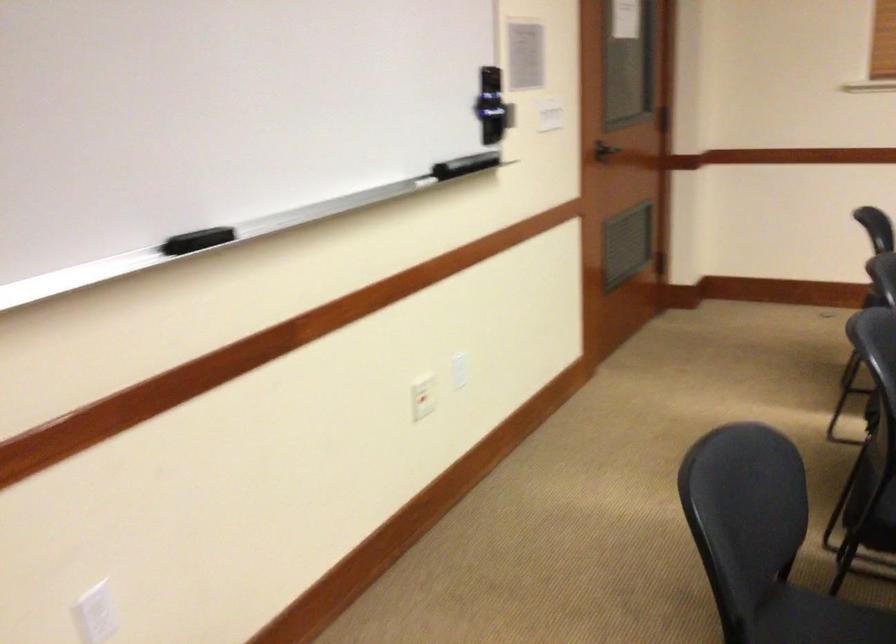
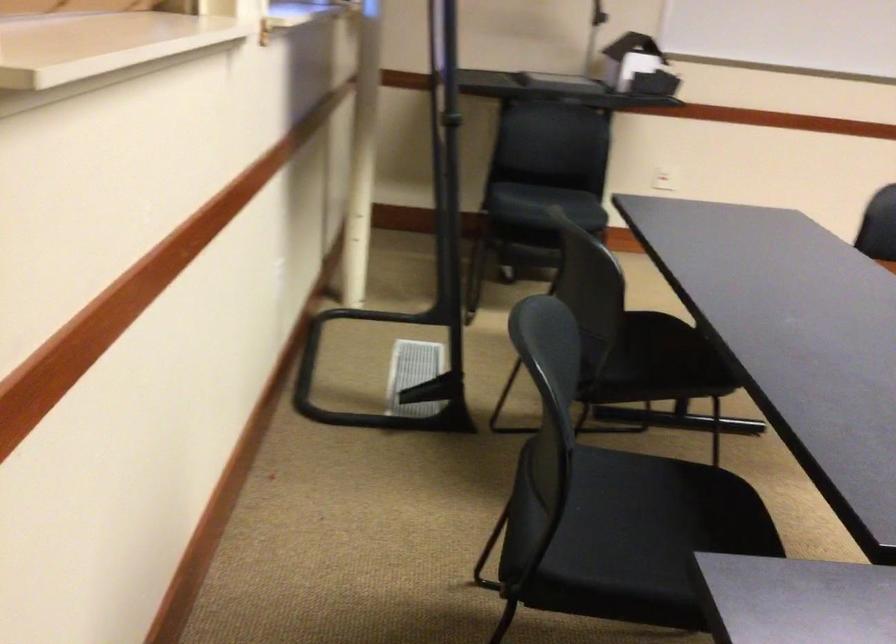
Question: The images are taken continuously from a first-person perspective. In which direction are you moving?

Choices:
 (A) Left
 (B) Right
 (C) Forward
 (D) Backward

Answer: (D)